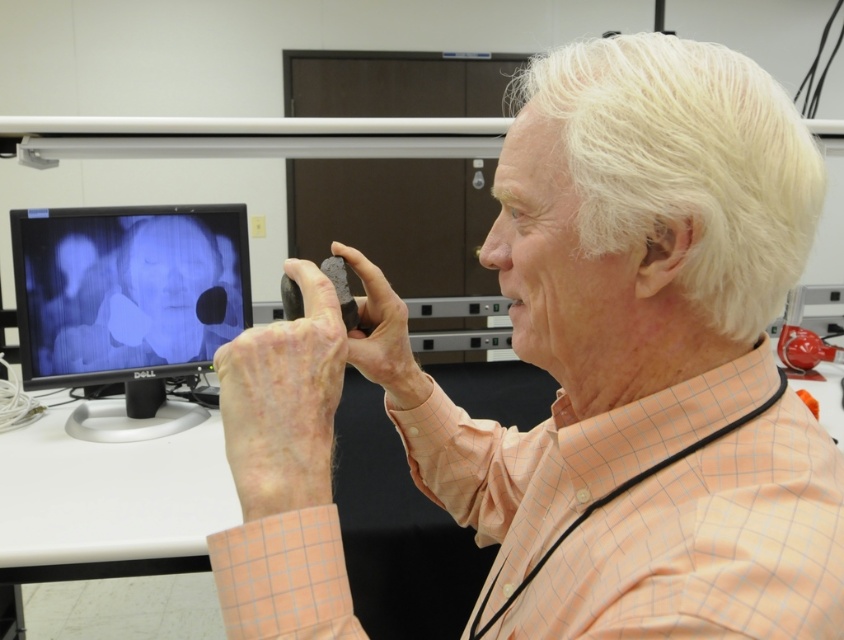
Question: Can you confirm if matte black rock at center is positioned above matte black monitor at left?

Choices:
 (A) no
 (B) yes

Answer: (A)

Question: Which point appears closest to the camera in this image?

Choices:
 (A) (283, 600)
 (B) (127, 241)

Answer: (A)

Question: Which point is farther to the camera?

Choices:
 (A) matte black rock at center
 (B) matte black monitor at left

Answer: (B)

Question: Is the position of matte black rock at center less distant than that of matte black monitor at left?

Choices:
 (A) no
 (B) yes

Answer: (B)

Question: Does matte black rock at center appear on the left side of matte black monitor at left?

Choices:
 (A) yes
 (B) no

Answer: (B)